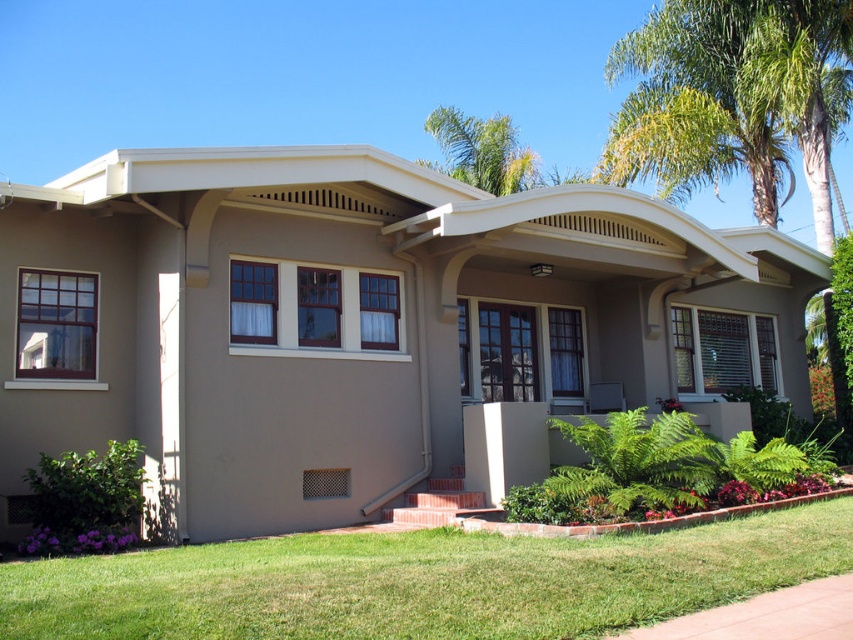
Question: Among these objects, which one is farthest from the camera?

Choices:
 (A) green grass at lower center
 (B) green leafy palm tree at upper right

Answer: (B)

Question: Does green grass at lower center lie in front of green leafy palm tree at upper right?

Choices:
 (A) yes
 (B) no

Answer: (A)

Question: Estimate the real-world distances between objects in this image. Which object is farther from the green grass at lower center?

Choices:
 (A) green leafy palm tree at upper right
 (B) green leafy palm tree at upper center

Answer: (B)

Question: Is green leafy palm tree at upper right smaller than green leafy palm tree at upper center?

Choices:
 (A) yes
 (B) no

Answer: (B)

Question: Can you confirm if green leafy palm tree at upper right is positioned above green leafy palm tree at upper center?

Choices:
 (A) no
 (B) yes

Answer: (B)

Question: Considering the real-world distances, which object is farthest from the green leafy palm tree at upper right?

Choices:
 (A) green grass at lower center
 (B) green leafy palm tree at upper center

Answer: (A)